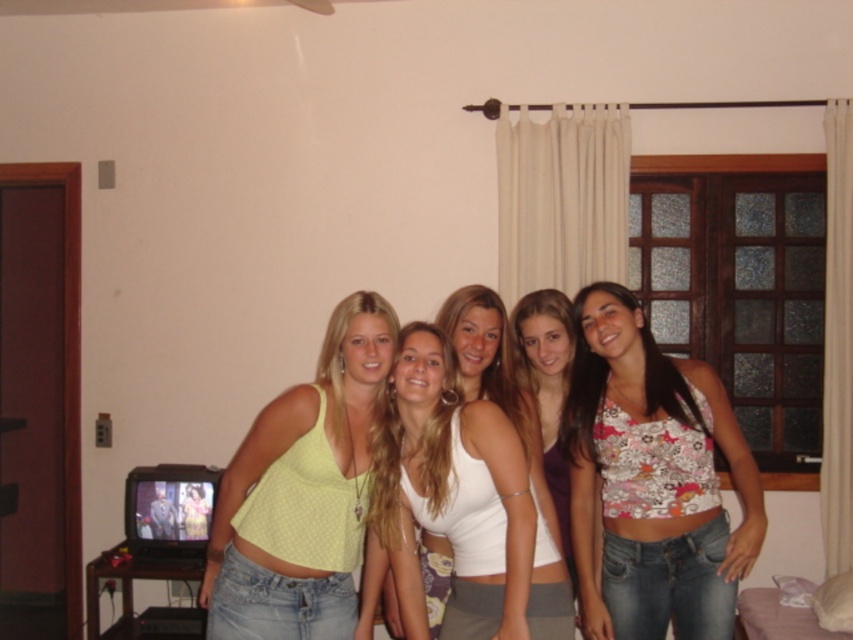
You are a photographer trying to adjust the lighting between the light yellow fabric top at center and the floral fabric top at center. Since they are 28.64 inches apart, what is the minimum distance your light should be placed to evenly illuminate both tops?

The minimum distance your light should be placed is at least 28.64 inches away from both the light yellow fabric top at center and the floral fabric top at center to ensure even illumination.

You are a photographer trying to adjust the lighting in the room so that both the light yellow fabric top at center and the floral fabric top at center are equally illuminated. Which top should you focus the light on to achieve this?

The light yellow fabric top at center is not as tall as the floral fabric top at center, so you should focus the light on the light yellow fabric top at center to ensure both receive equal illumination.